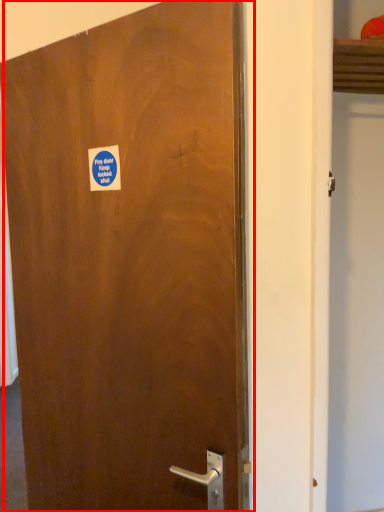
Question: In this image, where is door (annotated by the red box) located relative to sticker?

Choices:
 (A) left
 (B) right

Answer: (B)